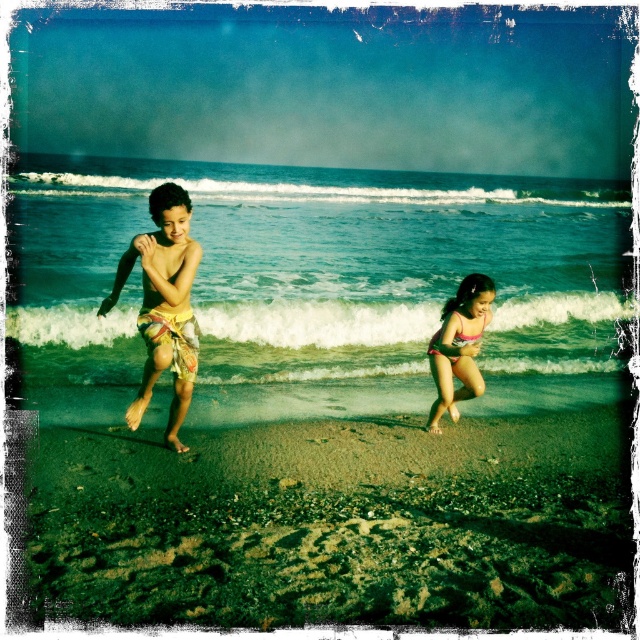
At what (x,y) coordinates should I click in order to perform the action: click on blue water at center. Please return your answer as a coordinate pair (x, y). Looking at the image, I should click on (317, 268).

Is point (236, 212) closer to camera compared to point (148, 252)?

No, it is not.

The height and width of the screenshot is (640, 640). Identify the location of blue water at center. (317, 268).

Does brown sandy beach at lower center appear on the right side of pink fabric swimsuit at right?

Incorrect, brown sandy beach at lower center is not on the right side of pink fabric swimsuit at right.

Who is taller, brown sandy beach at lower center or pink fabric swimsuit at right?

With more height is pink fabric swimsuit at right.

This screenshot has width=640, height=640. What do you see at coordinates (339, 524) in the screenshot?
I see `brown sandy beach at lower center` at bounding box center [339, 524].

The image size is (640, 640). Identify the location of brown sandy beach at lower center. (339, 524).

Measure the distance between blue water at center and camera.

blue water at center is 28.18 feet away from camera.

Which of these two, blue water at center or pink fabric swimsuit at right, stands taller?

blue water at center is taller.

Between point (131, 292) and point (468, 346), which one is positioned behind?

The point (131, 292) is more distant.

The height and width of the screenshot is (640, 640). Identify the location of blue water at center. (317, 268).